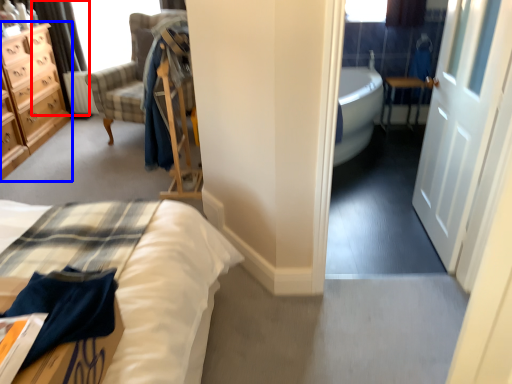
Question: Which of the following is the farthest to the observer, curtain (highlighted by a red box) or chest of drawers (highlighted by a blue box)?

Choices:
 (A) curtain
 (B) chest of drawers

Answer: (A)